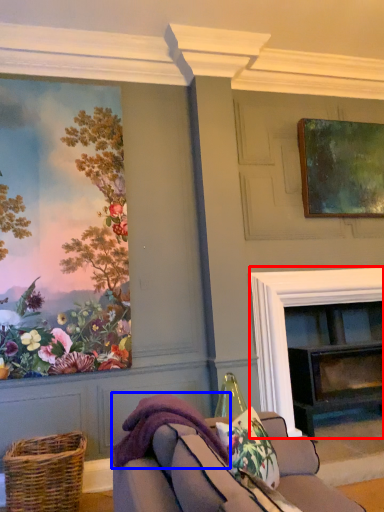
Question: Among these objects, which one is nearest to the camera, fireplace (highlighted by a red box) or blanket (highlighted by a blue box)?

Choices:
 (A) fireplace
 (B) blanket

Answer: (B)